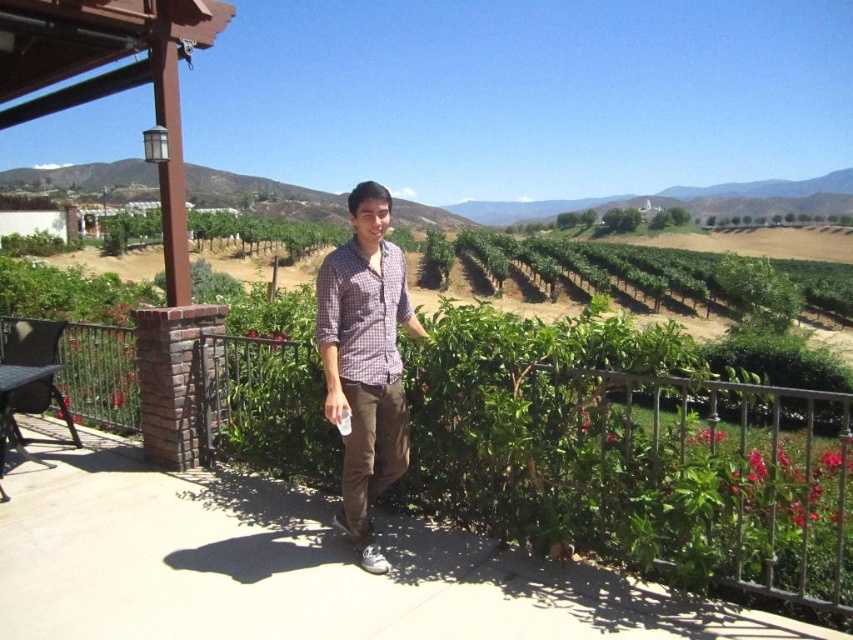
Does brown concrete porch at center appear over plaid cotton shirt at center?

No.

Is brown concrete porch at center wider than plaid cotton shirt at center?

Incorrect, brown concrete porch at center's width does not surpass plaid cotton shirt at center's.

Measure the distance between point (498, 400) and camera.

Point (498, 400) is 3.33 meters from camera.

Locate an element on the screen. The height and width of the screenshot is (640, 853). brown concrete porch at center is located at coordinates (637, 468).